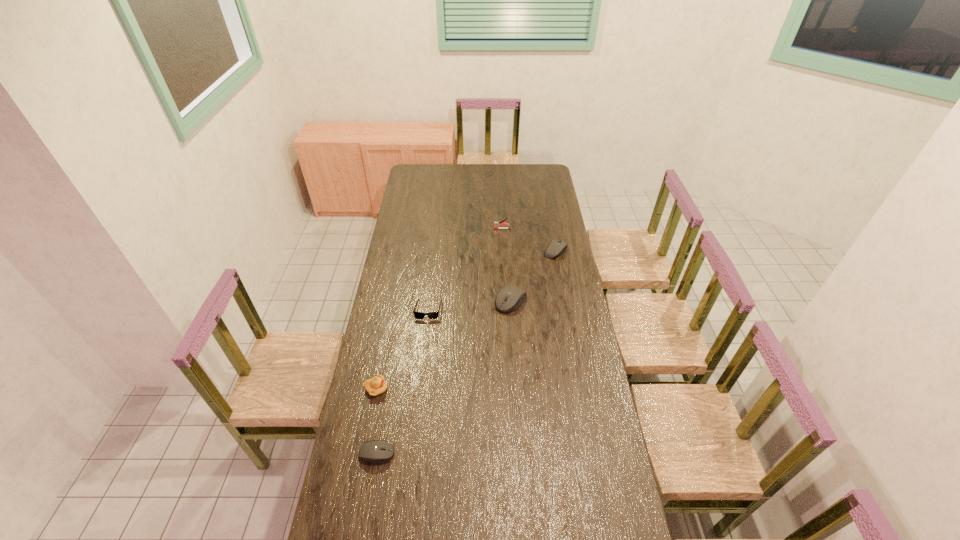
I want to click on free spot between the sunglasses and the stapler, so click(466, 269).

The width and height of the screenshot is (960, 540). Find the location of `empty location between the nearest object and the sunglasses`. empty location between the nearest object and the sunglasses is located at coordinates (403, 381).

Locate an element on the screen. This screenshot has width=960, height=540. vacant area that lies between the fifth farthest object and the rightmost object is located at coordinates (466, 320).

Identify the location of empty space that is in between the fifth farthest object and the second computer equipment from left to right. (444, 345).

Identify which object is the fifth nearest to the second nearest object. Please provide its 2D coordinates. Your answer should be formatted as a tuple, i.e. [(x, y)], where the tuple contains the x and y coordinates of a point satisfying the conditions above.

[(496, 224)]

Locate which object ranks in proximity to the leftmost computer equipment. Please provide its 2D coordinates. Your answer should be formatted as a tuple, i.e. [(x, y)], where the tuple contains the x and y coordinates of a point satisfying the conditions above.

[(377, 385)]

Identify which computer equipment is the nearest to the sunglasses. Please provide its 2D coordinates. Your answer should be formatted as a tuple, i.e. [(x, y)], where the tuple contains the x and y coordinates of a point satisfying the conditions above.

[(510, 297)]

Choose which computer equipment is the nearest neighbor to the leftmost computer equipment. Please provide its 2D coordinates. Your answer should be formatted as a tuple, i.e. [(x, y)], where the tuple contains the x and y coordinates of a point satisfying the conditions above.

[(510, 297)]

At what (x,y) coordinates should I click in order to perform the action: click on free space that satisfies the following two spatial constraints: 1. on the front-facing side of the second nearest object; 2. on the left side of the nearest object. Please return your answer as a coordinate pair (x, y). Image resolution: width=960 pixels, height=540 pixels. Looking at the image, I should click on (364, 453).

Locate an element on the screen. This screenshot has height=540, width=960. free location that satisfies the following two spatial constraints: 1. on the handle side of the stapler; 2. on the right side of the rightmost computer equipment is located at coordinates (503, 251).